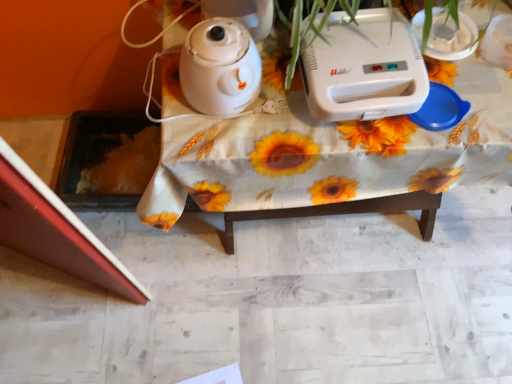
Where is `free space in front of white plastic table at center`? The image size is (512, 384). free space in front of white plastic table at center is located at coordinates (326, 327).